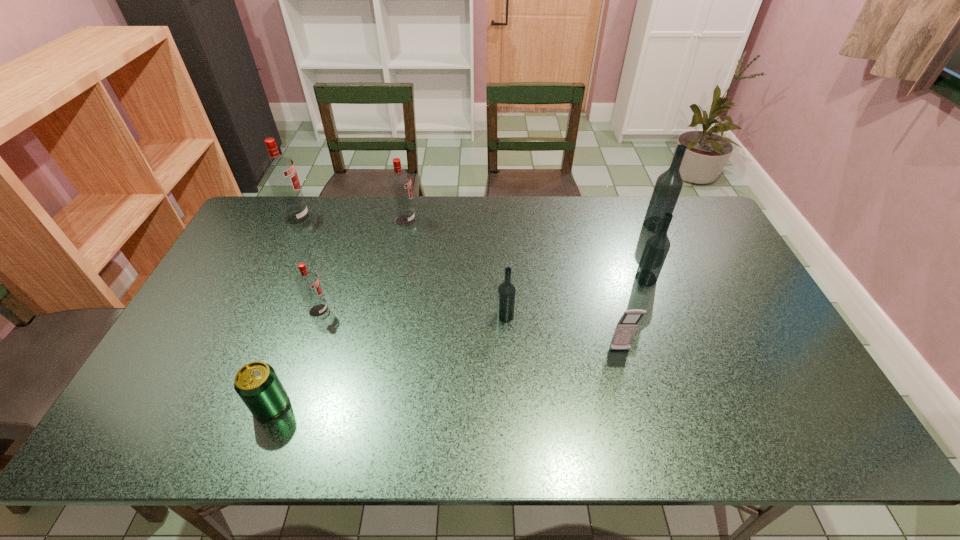
The height and width of the screenshot is (540, 960). Find the location of `free space at the left edge`. free space at the left edge is located at coordinates (195, 308).

The image size is (960, 540). In the image, there is a desktop. In order to click on vacant region at the far left corner in this screenshot , I will do `click(266, 237)`.

Identify the location of free spot at the near left corner of the desktop. (183, 417).

The width and height of the screenshot is (960, 540). I want to click on vacant space at the far right corner, so click(684, 208).

This screenshot has height=540, width=960. What are the coordinates of `free space between the rightmost vodka and the gray cellular telephone` in the screenshot? It's located at (637, 288).

Identify the location of empty space that is in between the nearest red vodka and the rightmost object. (487, 268).

The height and width of the screenshot is (540, 960). In order to click on free space between the leftmost vodka and the fifth object from right to left in this screenshot , I will do `click(351, 219)`.

The height and width of the screenshot is (540, 960). I want to click on vacant region between the rightmost red vodka and the nearest object, so [338, 313].

The image size is (960, 540). What are the coordinates of `unoccupied position between the leftmost vodka and the second vodka from left to right` in the screenshot? It's located at (308, 265).

At what (x,y) coordinates should I click in order to perform the action: click on vacant region between the fifth object from right to left and the green beer can. Please return your answer as a coordinate pair (x, y). Looking at the image, I should click on (338, 313).